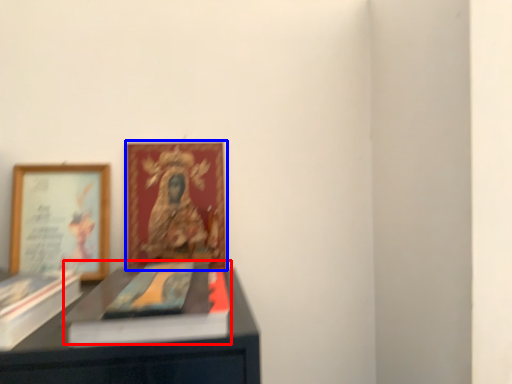
Question: Which of the following is the closest to the observer, book cover (highlighted by a red box) or picture frame (highlighted by a blue box)?

Choices:
 (A) book cover
 (B) picture frame

Answer: (A)